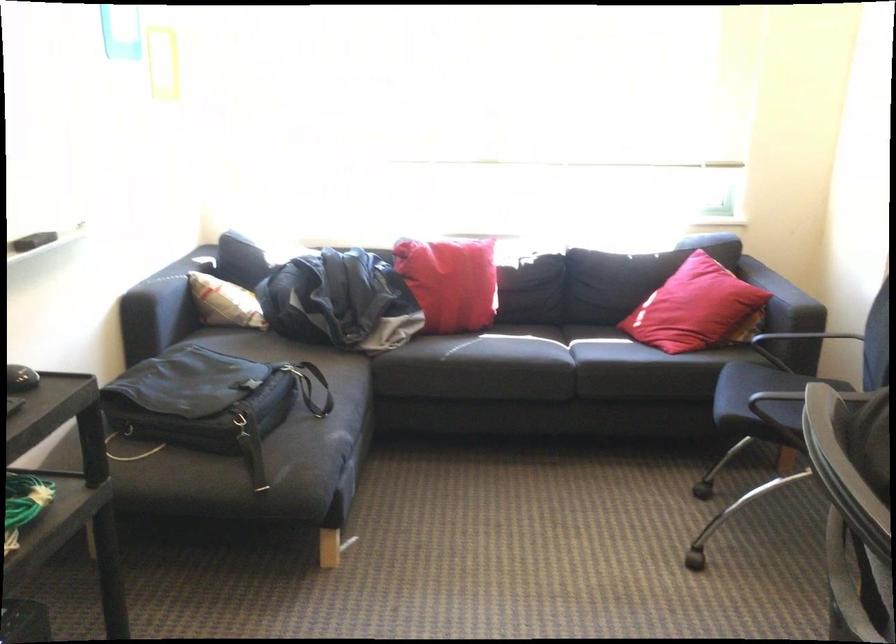
Find the location of a particular element. black chair sitting surface is located at coordinates (757, 395).